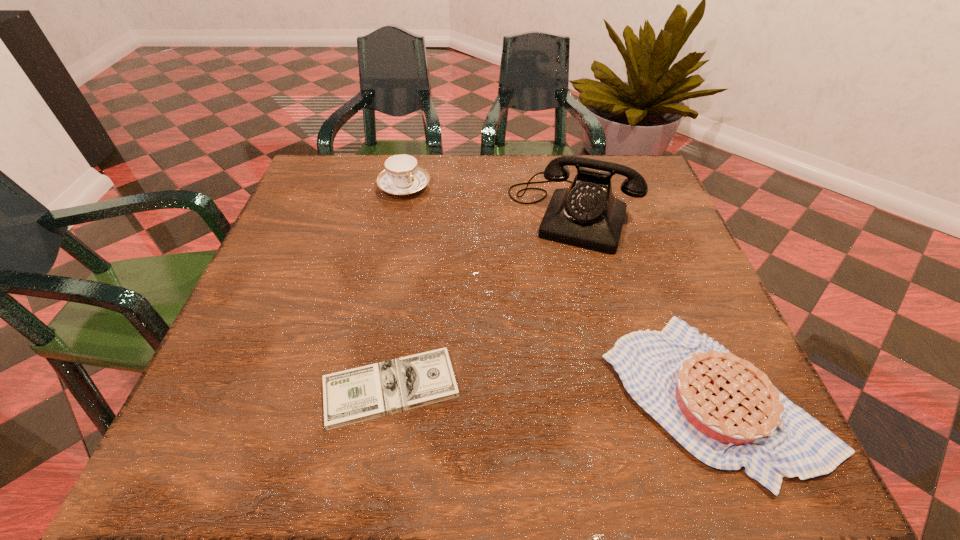
Locate an element on the screen. The width and height of the screenshot is (960, 540). free spot that satisfies the following two spatial constraints: 1. on the front side of the teacup; 2. on the right side of the telephone is located at coordinates (398, 214).